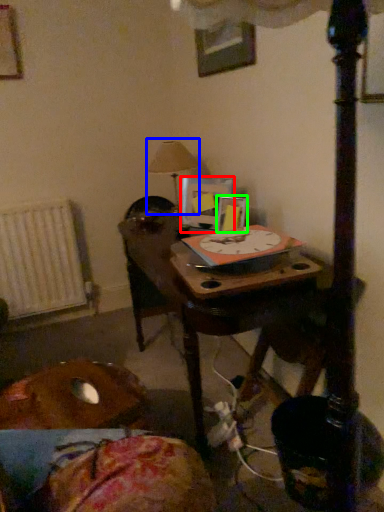
Question: Which object is the closest to the picture frame (highlighted by a red box)? Choose among these: table lamp (highlighted by a blue box) or picture frame (highlighted by a green box).

Choices:
 (A) table lamp
 (B) picture frame

Answer: (B)